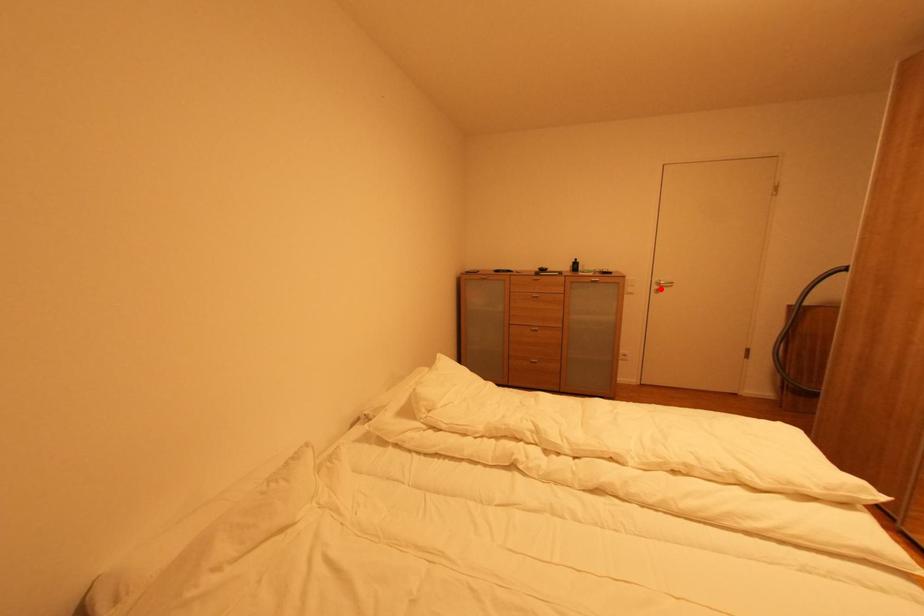
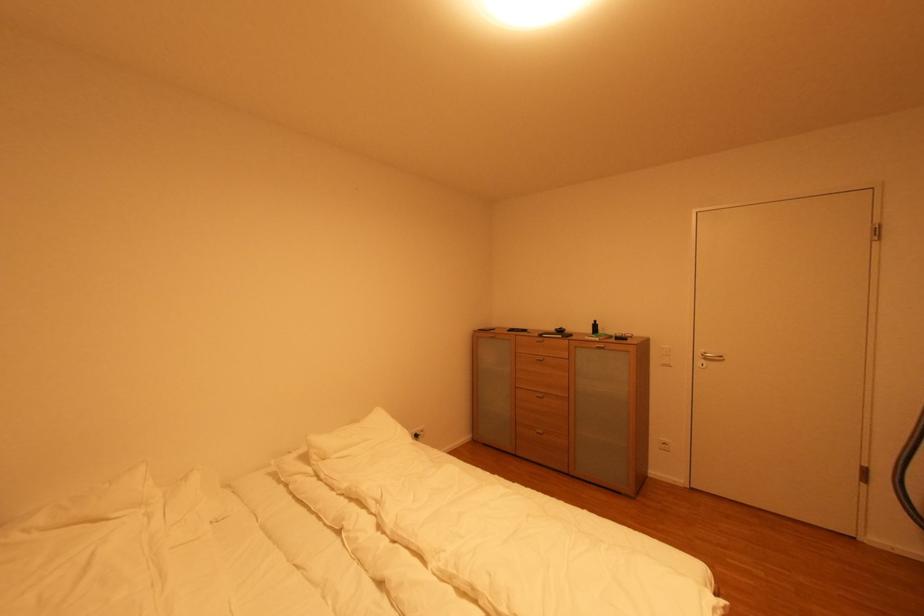
Locate, in the second image, the point that corresponds to the highlighted location in the first image.

(706, 362)